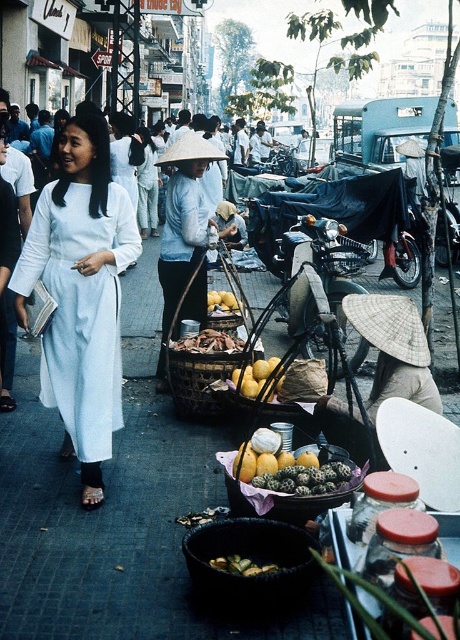
Question: Which object is positioned closest to the white matte dress at center?

Choices:
 (A) wooden woven basket at center
 (B) dark gray pavement at center
 (C) woven bamboo basket at center
 (D) light blue cotton robe at center

Answer: (C)

Question: Can you confirm if wooden woven basket at center is positioned below yellow matte fruit at center?

Choices:
 (A) yes
 (B) no

Answer: (A)

Question: Estimate the real-world distances between objects in this image. Which object is farther from the matte straw hat at center?

Choices:
 (A) woven bamboo basket at center
 (B) dark gray pavement at center
 (C) yellow matte fruit at center
 (D) yellow matte bananas at center

Answer: (D)

Question: Can you confirm if light blue cotton robe at center is bigger than white cotton hat at center?

Choices:
 (A) yes
 (B) no

Answer: (B)

Question: Considering the relative positions of matte straw hat at center and light blue cotton robe at center in the image provided, where is matte straw hat at center located with respect to light blue cotton robe at center?

Choices:
 (A) right
 (B) left

Answer: (A)

Question: Which object is positioned closest to the wooden woven basket at center?

Choices:
 (A) white matte dress at center
 (B) matte straw hat at center

Answer: (B)